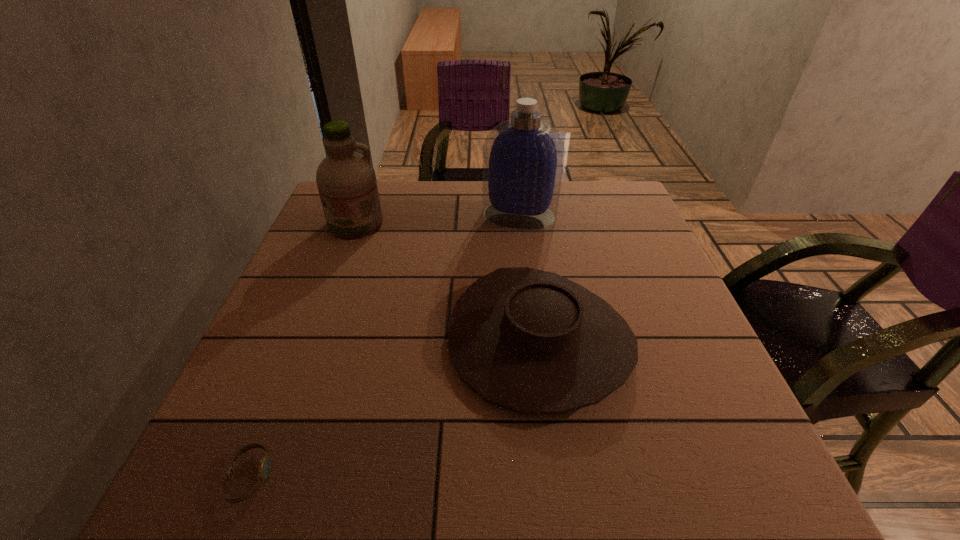
What are the coordinates of `free space at the far right corner of the desktop` in the screenshot? It's located at (601, 210).

This screenshot has height=540, width=960. Find the location of `vacant region between the left cleansing agent and the right cleansing agent`. vacant region between the left cleansing agent and the right cleansing agent is located at coordinates (438, 220).

This screenshot has width=960, height=540. What are the coordinates of `empty location between the left cleansing agent and the right cleansing agent` in the screenshot? It's located at (x=438, y=220).

The image size is (960, 540). Identify the location of free area in between the left cleansing agent and the watch. (302, 351).

Find the location of `free space that is in between the left cleansing agent and the nearest object`. free space that is in between the left cleansing agent and the nearest object is located at coordinates (302, 351).

Image resolution: width=960 pixels, height=540 pixels. I want to click on blank region between the nearest object and the right cleansing agent, so click(385, 346).

Image resolution: width=960 pixels, height=540 pixels. In order to click on free space between the left cleansing agent and the cowboy hat in this screenshot , I will do `click(447, 282)`.

This screenshot has width=960, height=540. In order to click on vacant space in between the watch and the second shortest object in this screenshot , I will do click(x=395, y=409).

Image resolution: width=960 pixels, height=540 pixels. I want to click on object that is the closest to the shortest object, so click(531, 341).

Select which object is the closest to the watch. Please provide its 2D coordinates. Your answer should be formatted as a tuple, i.e. [(x, y)], where the tuple contains the x and y coordinates of a point satisfying the conditions above.

[(531, 341)]